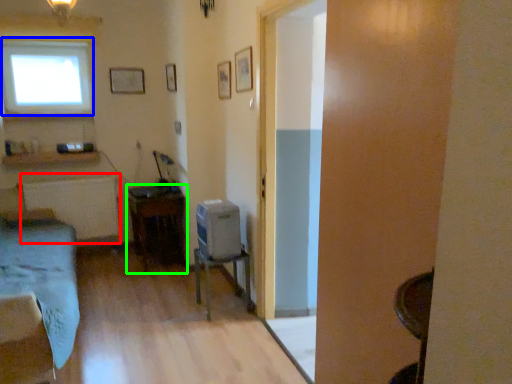
Question: Which object is the closest to the radiator (highlighted by a red box)? Choose among these: window (highlighted by a blue box) or table (highlighted by a green box).

Choices:
 (A) window
 (B) table

Answer: (B)